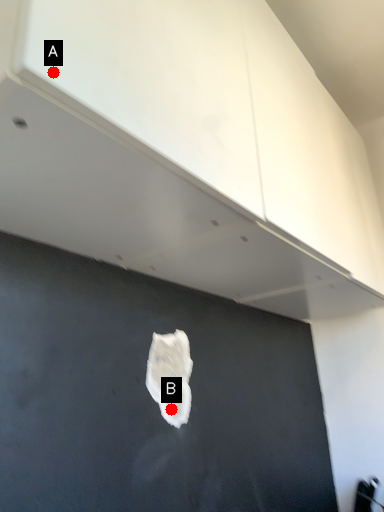
Question: Two points are circled on the image, labeled by A and B beside each circle. Which of the following is the farthest from the observer?

Choices:
 (A) A is further
 (B) B is further

Answer: (B)